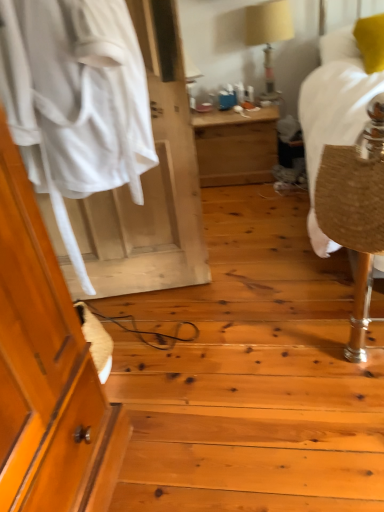
Question: In terms of size, does burlap-like fabric at right appear bigger or smaller than beige fabric lampshade at upper center?

Choices:
 (A) small
 (B) big

Answer: (A)

Question: Is burlap-like fabric at right in front of or behind beige fabric lampshade at upper center in the image?

Choices:
 (A) behind
 (B) front

Answer: (B)

Question: Considering the real-world distances, which object is closest to the burlap-like fabric at right?

Choices:
 (A) white fabric at left
 (B) wooden desk at center
 (C) beige fabric lampshade at upper center
 (D) yellow fabric pillow at upper right

Answer: (D)

Question: Which is farther from the burlap-like fabric at right?

Choices:
 (A) beige fabric lampshade at upper center
 (B) wooden desk at center
 (C) yellow fabric pillow at upper right
 (D) white fabric at left

Answer: (D)